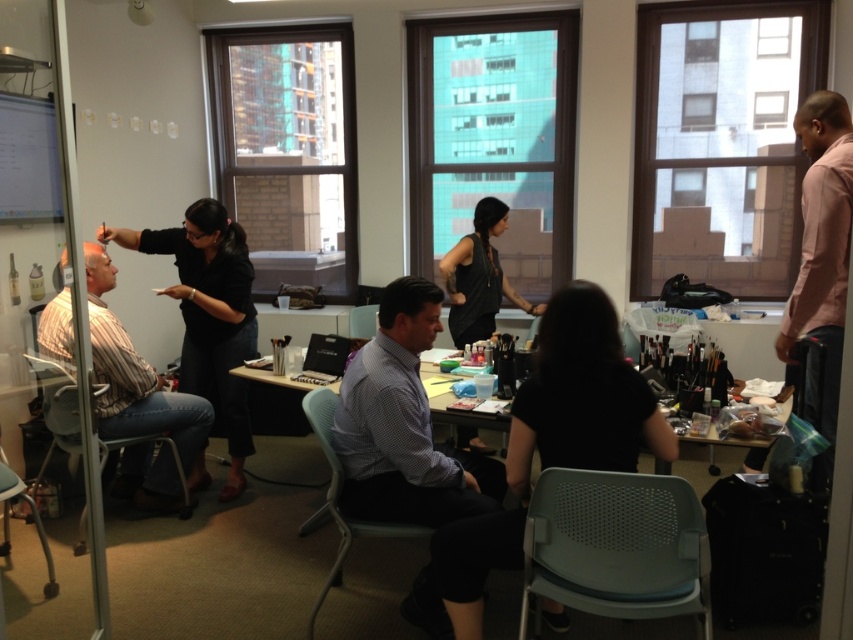
You are a photographer setting up a shoot in the studio. You need to position a light source so that it illuminates the striped cotton shirt at left without casting a shadow from the brown matte hair at upper right. Is this possible given their current positions?

The brown matte hair at upper right is behind the striped cotton shirt at left, so positioning the light source in front of the striped cotton shirt at left would prevent the hair from casting a shadow on it.

You are a stylist preparing for a client appointment. You need to place a 1.2 meter long accessory display on the floor. Given the gray perforated plastic chair at lower center and the black fabric at left, which object can accommodate the display without overlapping?

The black fabric at left can accommodate the 1.2 meter long accessory display since it is larger than the gray perforated plastic chair at lower center.

You are a photographer standing in the room and want to take a photo of the gray perforated plastic chair at lower center. However, there is a black fabric at left that might block the view. Based on their positions, can you see the chair clearly without the fabric blocking it?

The gray perforated plastic chair at lower center is closer to the viewer than the black fabric at left, so you can see the chair clearly without the fabric blocking it.